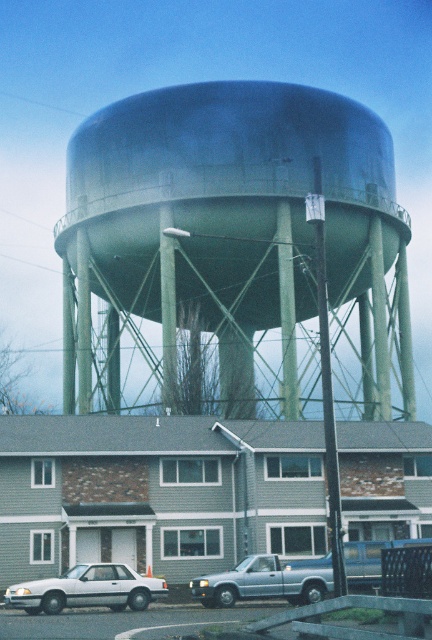
Question: Which of these objects is positioned closest to the metallic silver truck at center?

Choices:
 (A) green matte water tower at center
 (B) white matte sedan at lower left

Answer: (B)

Question: Considering the real-world distances, which object is closest to the white matte sedan at lower left?

Choices:
 (A) green matte water tower at center
 (B) metallic silver truck at center

Answer: (B)

Question: Is green matte water tower at center thinner than metallic silver truck at center?

Choices:
 (A) yes
 (B) no

Answer: (B)

Question: Considering the real-world distances, which object is farthest from the green matte water tower at center?

Choices:
 (A) white matte sedan at lower left
 (B) silver metallic truck at lower center
 (C) metallic silver truck at center

Answer: (A)

Question: Is green matte water tower at center closer to the viewer compared to metallic silver truck at center?

Choices:
 (A) no
 (B) yes

Answer: (A)

Question: Can you confirm if green matte water tower at center is positioned to the left of white matte sedan at lower left?

Choices:
 (A) yes
 (B) no

Answer: (B)